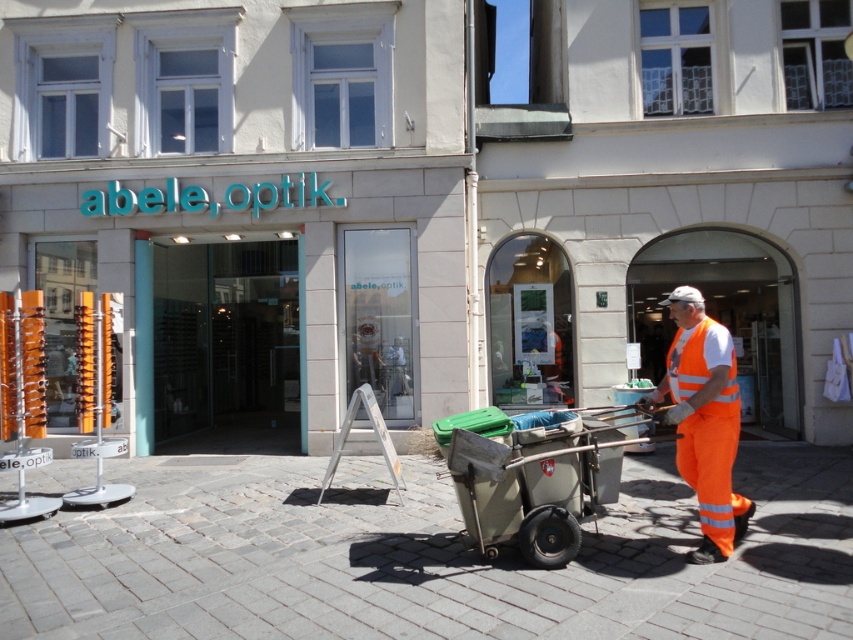
What are the coordinates of the metallic gray cart at center?

→ The coordinates of the metallic gray cart at center are point (537,483).

You are standing at the camera position and want to walk to the brick paved at center. Is the distance less than 25 feet?

Yes, the brick paved at center is 24.99 feet away from the camera, so the distance is less than 25 feet.

You are a delivery person trying to park your bike near the brick paved at center and the high visibility orange jumpsuit at center. Since you need to choose the larger space to park, which one should you choose?

The high visibility orange jumpsuit at center is larger than the brick paved at center, so you should choose the high visibility orange jumpsuit at center to park your bike.